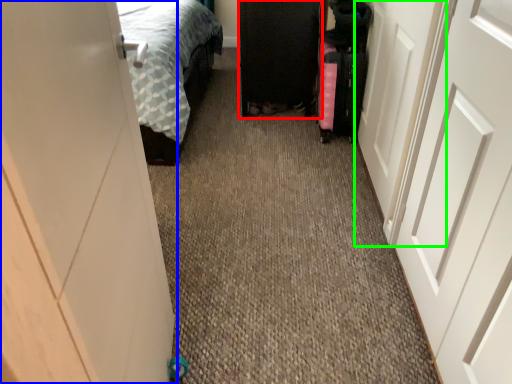
Question: Estimate the real-world distances between objects in this image. Which object is closer to furniture (highlighted by a red box), door (highlighted by a blue box) or door (highlighted by a green box)?

Choices:
 (A) door
 (B) door

Answer: (B)